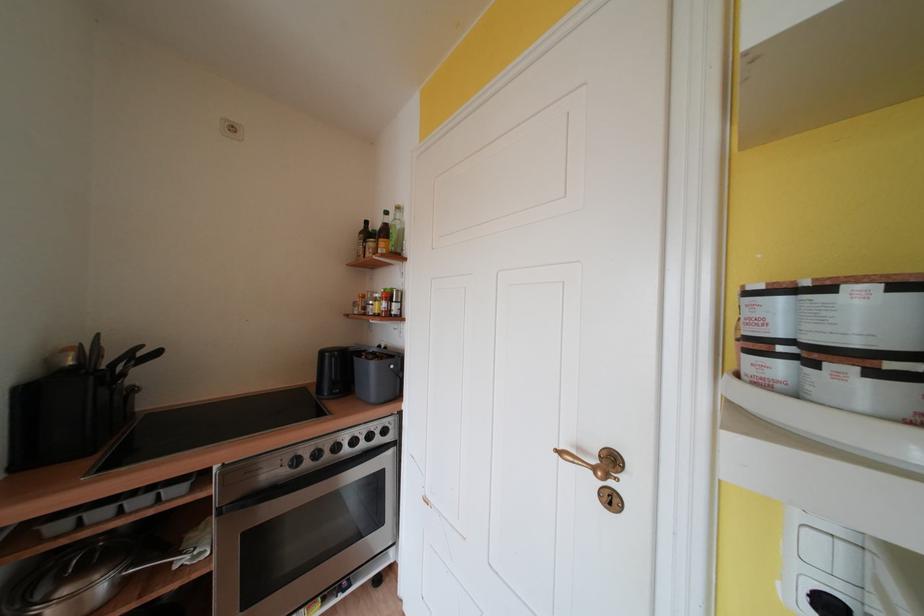
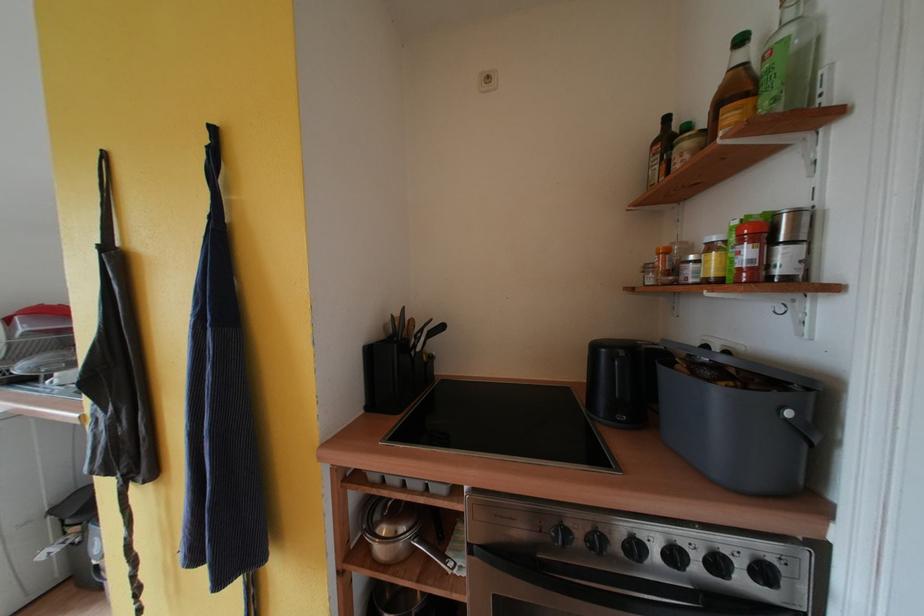
Find the pixel in the second image that matches (x=379, y=368) in the first image.

(723, 397)